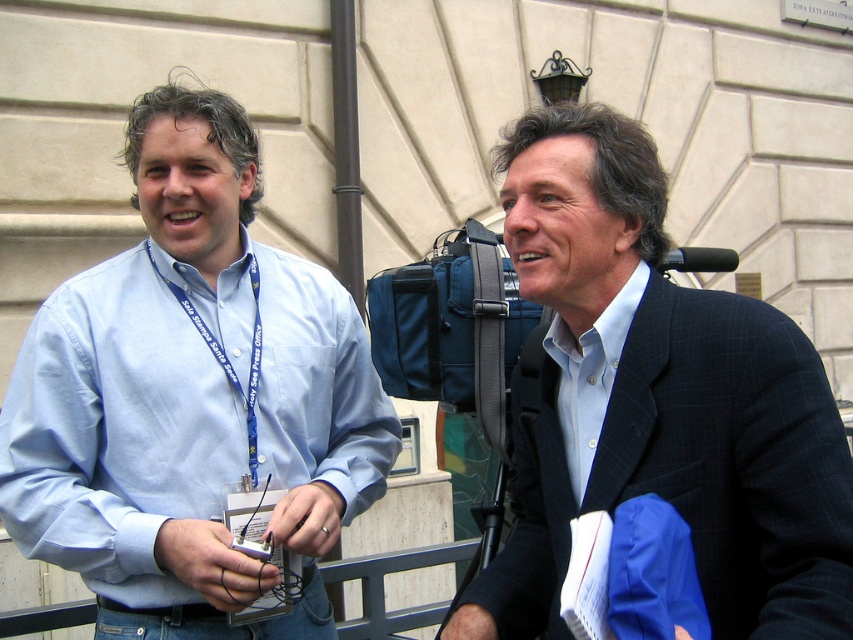
Question: Which object is closer to the camera taking this photo?

Choices:
 (A) matte blue shirt at center
 (B) matte black suit at right

Answer: (B)

Question: Does light blue shirt at center appear over matte black suit at right?

Choices:
 (A) yes
 (B) no

Answer: (B)

Question: Based on their relative distances, which object is farther from the light blue shirt at center?

Choices:
 (A) matte black suit at right
 (B) matte blue shirt at center

Answer: (B)

Question: Among these points, which one is farthest from the camera?

Choices:
 (A) (299, 620)
 (B) (227, 362)

Answer: (A)

Question: Is matte black suit at right further to camera compared to blue fabric lanyard at left?

Choices:
 (A) no
 (B) yes

Answer: (A)

Question: Considering the relative positions of matte black suit at right and matte blue shirt at center in the image provided, where is matte black suit at right located with respect to matte blue shirt at center?

Choices:
 (A) right
 (B) left

Answer: (A)